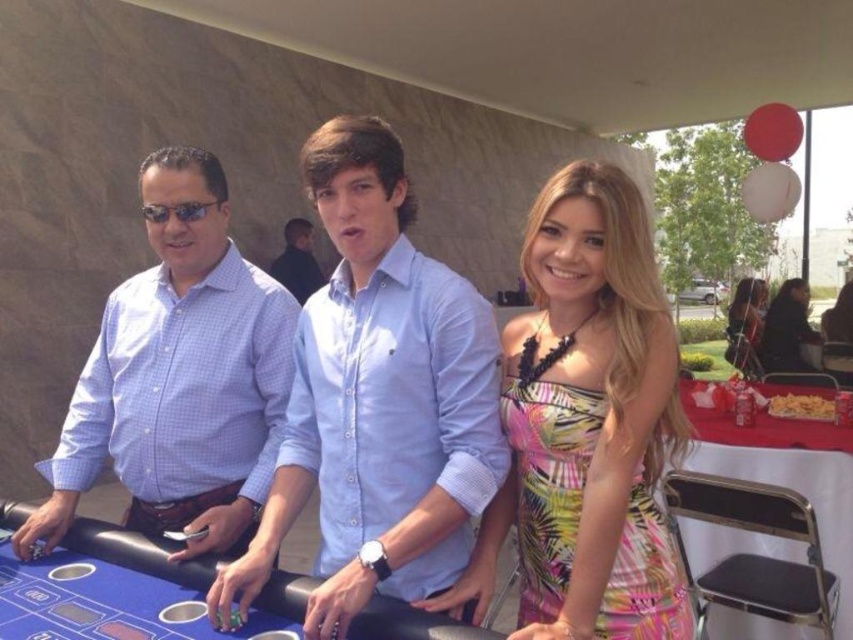
You are a photographer at the event and want to capture a photo of the printed silk dress at center without the blue felt table at center appearing in the background. Is this possible based on their positions?

Yes, since the printed silk dress at center is in front of the blue felt table at center, you can position the camera so that the dress blocks the table from view, ensuring the table does not appear in the background.

Consider the image. You are at the event and want to know if the matte blue shirt at left is wider than the matte black dress at center. Based on the scene description, what can you conclude?

The matte blue shirt at left has a lesser width compared to the matte black dress at center, so the matte blue shirt at left is narrower than the matte black dress at center.